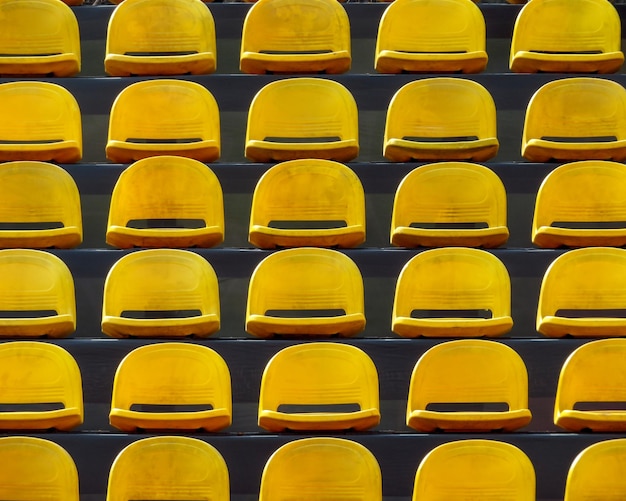
Identify the location of seats located 2nd row from the top. The width and height of the screenshot is (626, 501). (29, 123), (158, 118), (280, 102), (421, 100), (573, 107).